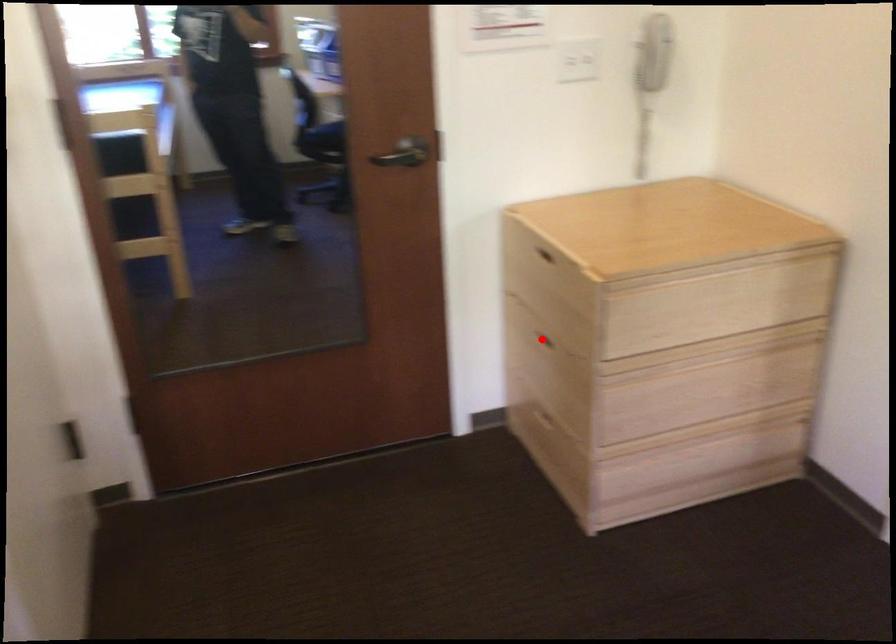
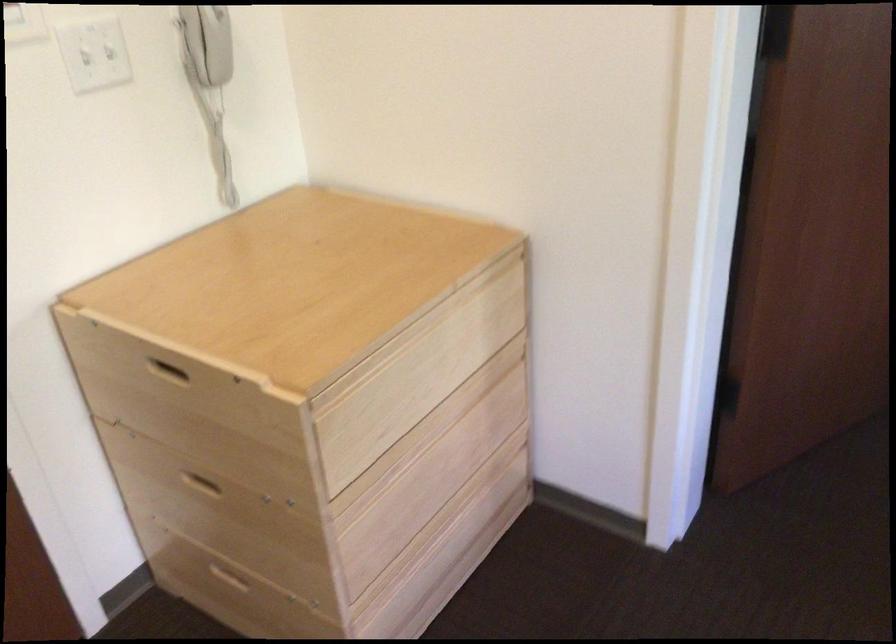
Where in the second image is the point corresponding to the highlighted location from the first image?

(201, 483)